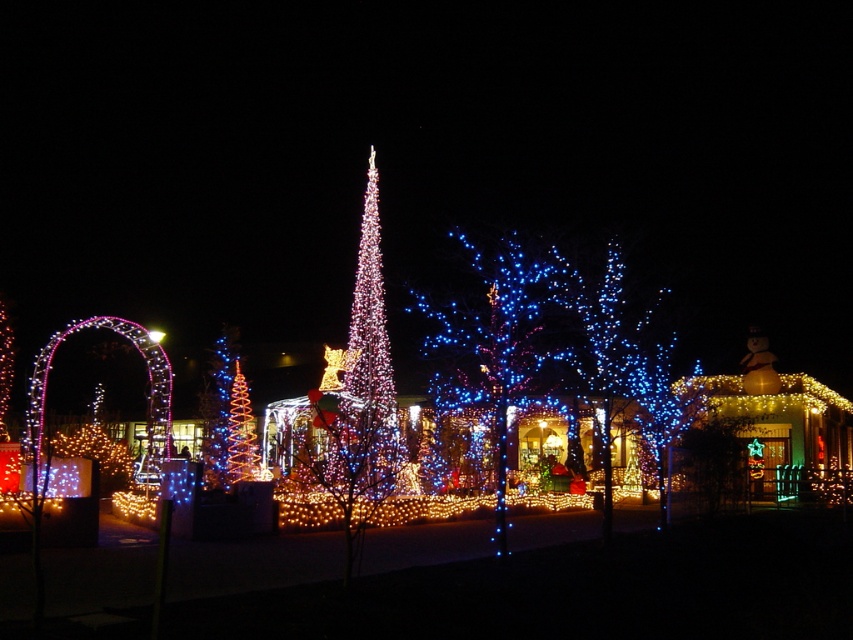
Question: Among these objects, which one is farthest from the camera?

Choices:
 (A) blue glossy tree at center
 (B) spiral-patterned lights at center

Answer: (B)

Question: Is blue glossy tree at center above spiral-patterned lights at center?

Choices:
 (A) no
 (B) yes

Answer: (B)

Question: Is blue glossy tree at center to the left of spiral-patterned lights at center from the viewer's perspective?

Choices:
 (A) no
 (B) yes

Answer: (A)

Question: Does blue glossy tree at center appear under spiral-patterned lights at center?

Choices:
 (A) yes
 (B) no

Answer: (B)